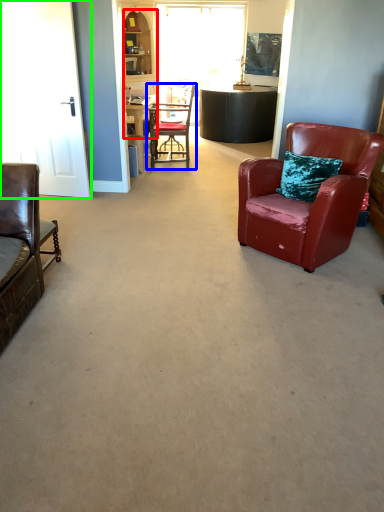
Question: Considering the real-world distances, which object is farthest from cabinetry (highlighted by a red box)? chair (highlighted by a blue box) or glass door (highlighted by a green box)?

Choices:
 (A) chair
 (B) glass door

Answer: (B)